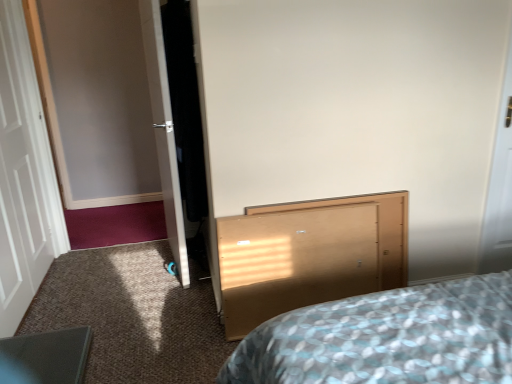
Question: Is light wood vanity at center wider than white glossy door at left, the first door from the right?

Choices:
 (A) yes
 (B) no

Answer: (B)

Question: Considering the relative positions of light wood vanity at center and white glossy door at left, the first door from the right, in the image provided, is light wood vanity at center to the right of white glossy door at left, the first door from the right, from the viewer's perspective?

Choices:
 (A) yes
 (B) no

Answer: (A)

Question: Is light wood vanity at center positioned in front of white glossy door at left, the first door from the right?

Choices:
 (A) yes
 (B) no

Answer: (A)

Question: From the image's perspective, is light wood vanity at center located above white glossy door at left, the first door from the right?

Choices:
 (A) yes
 (B) no

Answer: (B)

Question: Can you confirm if light wood vanity at center is smaller than white glossy door at left, the first door from the right?

Choices:
 (A) no
 (B) yes

Answer: (B)

Question: Is light wood vanity at center positioned behind white glossy door at left, the first door from the right?

Choices:
 (A) yes
 (B) no

Answer: (B)

Question: Can you confirm if light wood vanity at center is taller than white wooden door at left, arranged as the 1th door when viewed from the left?

Choices:
 (A) yes
 (B) no

Answer: (B)

Question: Considering the relative positions of light wood vanity at center and white wooden door at left, arranged as the 1th door when viewed from the left, in the image provided, is light wood vanity at center to the right of white wooden door at left, arranged as the 1th door when viewed from the left, from the viewer's perspective?

Choices:
 (A) no
 (B) yes

Answer: (B)

Question: Is light wood vanity at center thinner than white wooden door at left, arranged as the 1th door when viewed from the left?

Choices:
 (A) no
 (B) yes

Answer: (A)

Question: Is light wood vanity at center bigger than white wooden door at left, which ranks as the second door in right-to-left order?

Choices:
 (A) yes
 (B) no

Answer: (B)

Question: Can you confirm if light wood vanity at center is smaller than white wooden door at left, arranged as the 1th door when viewed from the left?

Choices:
 (A) yes
 (B) no

Answer: (A)

Question: Does light wood vanity at center have a greater width compared to white wooden door at left, arranged as the 1th door when viewed from the left?

Choices:
 (A) yes
 (B) no

Answer: (A)

Question: Can you confirm if white wooden door at left, which ranks as the second door in right-to-left order, is taller than white glossy door at left, which appears as the 2th door when viewed from the left?

Choices:
 (A) yes
 (B) no

Answer: (A)